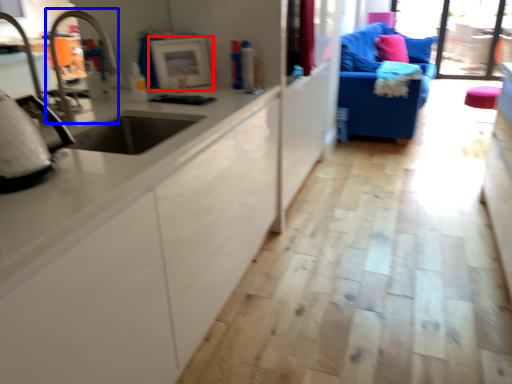
Question: Which point is further to the camera, appliance (highlighted by a red box) or faucet (highlighted by a blue box)?

Choices:
 (A) appliance
 (B) faucet

Answer: (A)